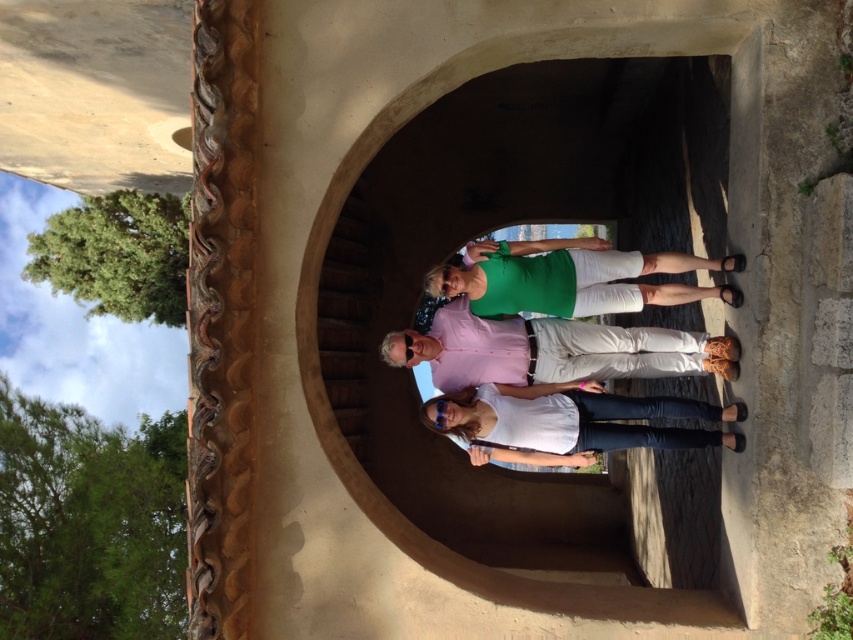
Question: Which object is positioned closest to the white matte shirt at center?

Choices:
 (A) white cotton pants at center
 (B) smooth stone archway at center
 (C) green matte shorts at center

Answer: (A)

Question: Does white cotton pants at center appear on the right side of white matte shirt at center?

Choices:
 (A) yes
 (B) no

Answer: (B)

Question: Can you confirm if smooth stone archway at center is positioned to the right of white matte shirt at center?

Choices:
 (A) no
 (B) yes

Answer: (B)

Question: Is white cotton pants at center to the right of green matte shorts at center from the viewer's perspective?

Choices:
 (A) no
 (B) yes

Answer: (A)

Question: Which point appears closest to the camera in this image?

Choices:
 (A) (676, 417)
 (B) (599, 282)
 (C) (498, 321)

Answer: (A)

Question: Which point is closer to the camera?

Choices:
 (A) (508, 342)
 (B) (599, 252)
 (C) (616, 413)
 (D) (392, 301)

Answer: (A)